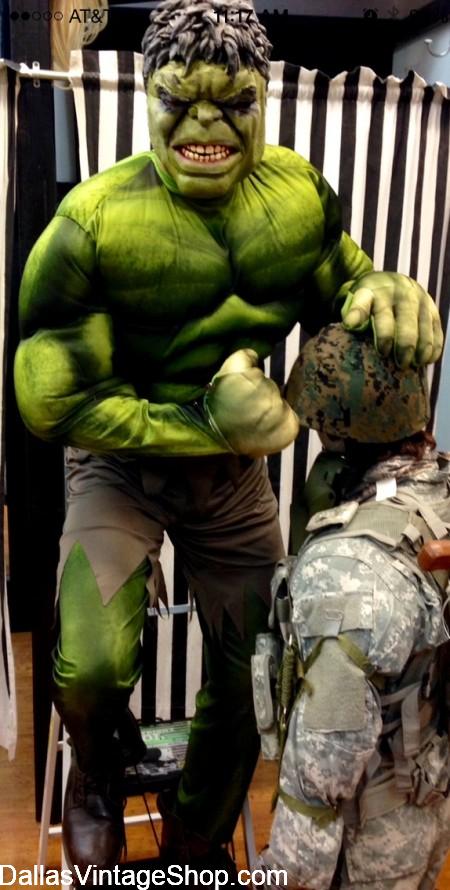
Image resolution: width=450 pixels, height=890 pixels. I want to click on black and white curtain, so click(x=376, y=142).